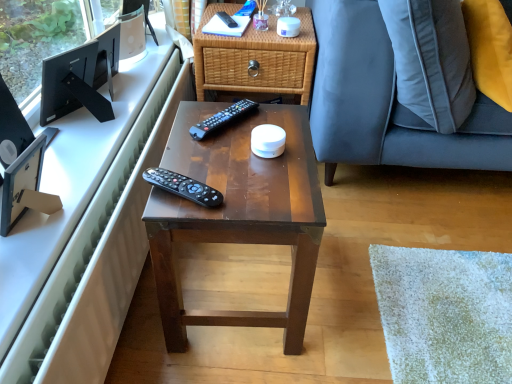
The height and width of the screenshot is (384, 512). I want to click on vacant area located to the right-hand side of black plastic remote control at center, marked as the third remote control in a top-to-bottom arrangement, so click(x=256, y=187).